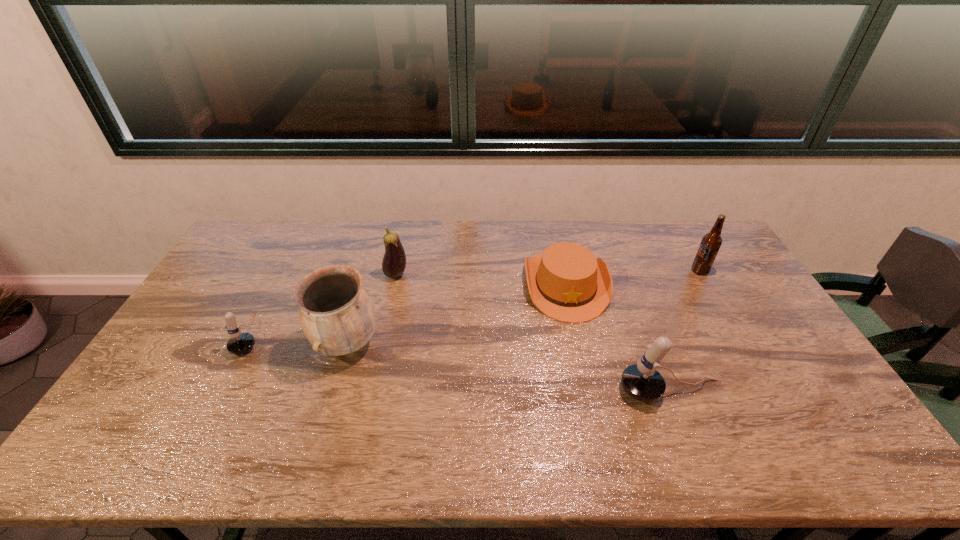
What are the coordinates of `the leftmost object` in the screenshot? It's located at click(x=239, y=343).

Where is `the farther microphone`? The image size is (960, 540). the farther microphone is located at coordinates (239, 343).

At what (x,y) coordinates should I click in order to perform the action: click on the taller microphone. Please return your answer as a coordinate pair (x, y). Image resolution: width=960 pixels, height=540 pixels. Looking at the image, I should click on (641, 381).

Image resolution: width=960 pixels, height=540 pixels. I want to click on the nearer microphone, so click(641, 381).

At what (x,y) coordinates should I click in order to perform the action: click on beer bottle. Please return your answer as a coordinate pair (x, y). The height and width of the screenshot is (540, 960). Looking at the image, I should click on [711, 242].

Identify the location of cowboy hat. (566, 282).

Find the location of a particular element. The height and width of the screenshot is (540, 960). eggplant is located at coordinates (394, 261).

This screenshot has width=960, height=540. I want to click on urn, so [x=337, y=316].

What are the coordinates of `free region located 0.250m on the back of the farther microphone` in the screenshot? It's located at (288, 263).

This screenshot has height=540, width=960. I want to click on free space located 0.200m on the right of the taller microphone, so click(x=797, y=390).